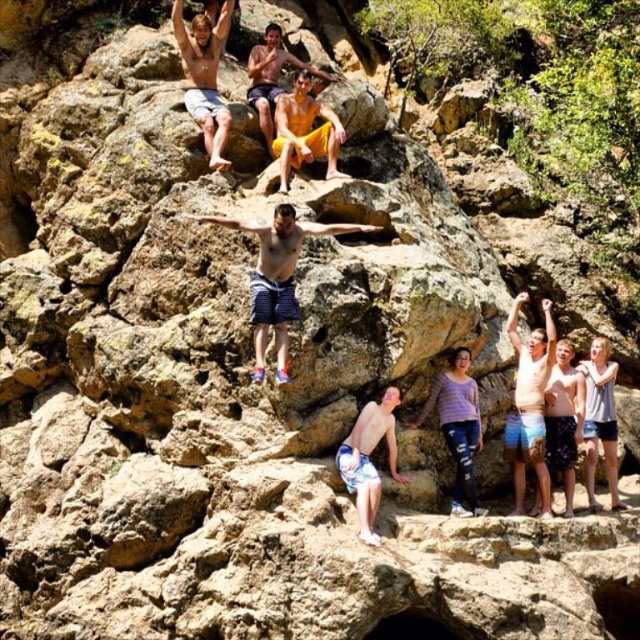
You are a photographer trying to capture a wide shot of the cliff jumping scene. You notice two people wearing striped shorts at center and matte blue shorts at center. Which person should you focus on to ensure they appear larger in your photo?

You should focus on the matte blue shorts at center because it occupies more space than the striped shorts at center, making it appear larger in the photo.

You are a photographer trying to capture the best angle of the cliff jumpers. You notice two points marked in the scene. Which point is closer to the camera? The two points are point (298, 252) and point (180, 24).

Point (298, 252) is in front of point (180, 24), so it is closer to the camera.

You are a photographer trying to capture a photo of the striped shorts at center and the matte skin at upper left. Which object is positioned closer to your camera lens?

The striped shorts at center is closer to the viewer than matte skin at upper left, so the striped shorts at center would appear larger in the photo.